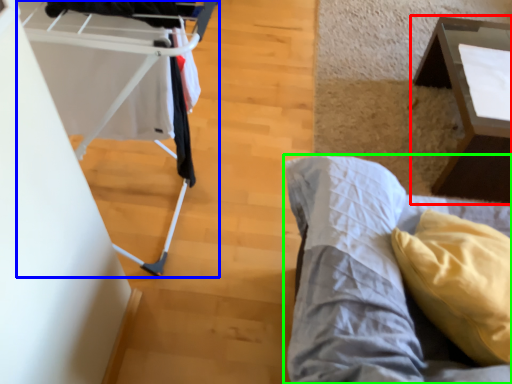
Question: Considering the real-world distances, which object is farthest from table (highlighted by a red box)? baby carriage (highlighted by a blue box) or furniture (highlighted by a green box)?

Choices:
 (A) baby carriage
 (B) furniture

Answer: (A)